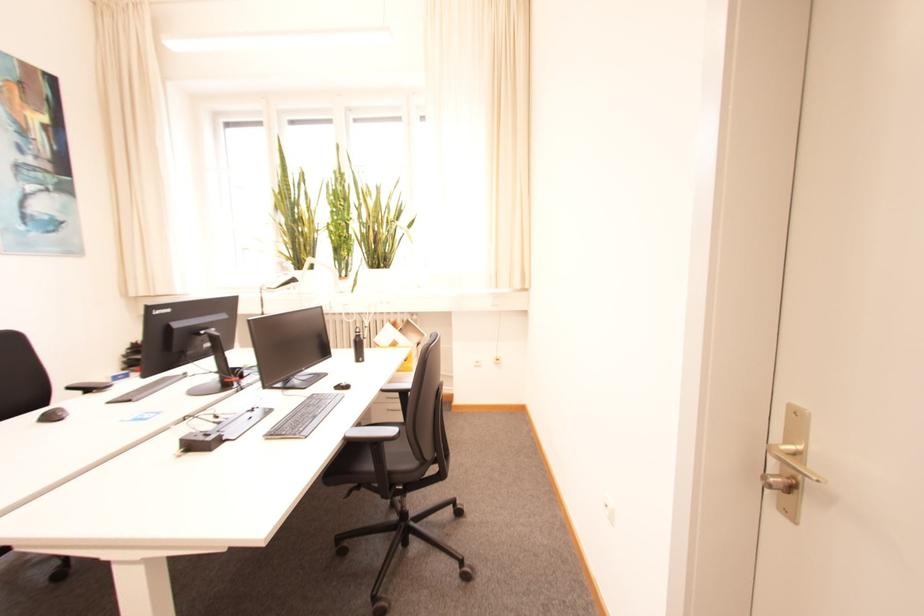
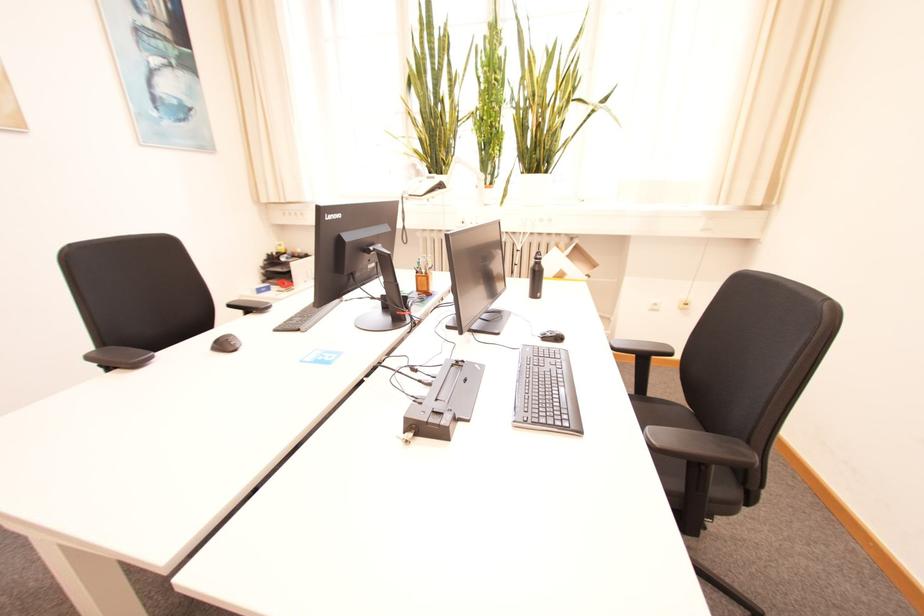
In the second image, find the point that corresponds to (x=57, y=419) in the first image.

(229, 346)